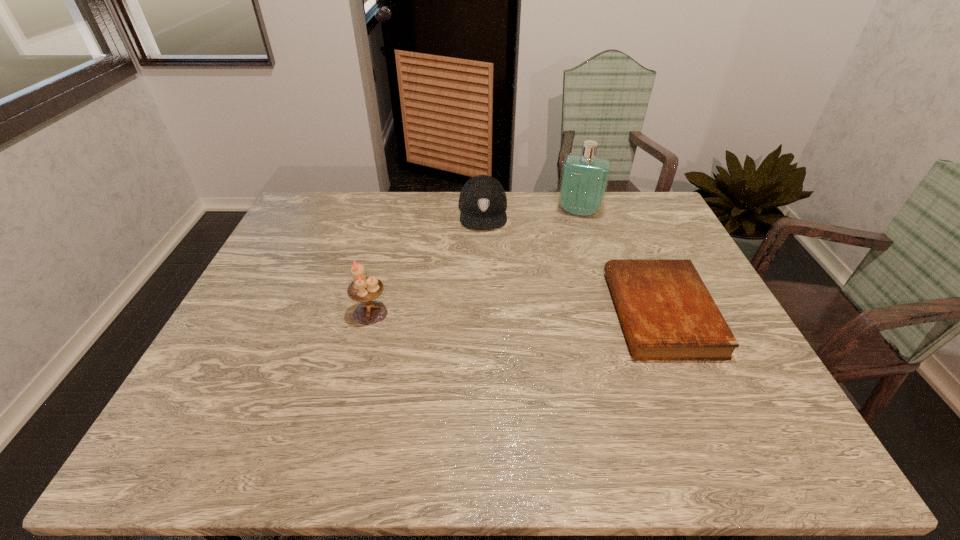
The width and height of the screenshot is (960, 540). Find the location of `vacant space on the desktop that is between the candle holder and the Bible and is positioned on the front label of the perfume`. vacant space on the desktop that is between the candle holder and the Bible and is positioned on the front label of the perfume is located at coordinates (555, 313).

Identify the location of free space on the desktop that is between the leftmost object and the shortest object and is positioned on the front-facing side of the third object from right to left. The width and height of the screenshot is (960, 540). (483, 313).